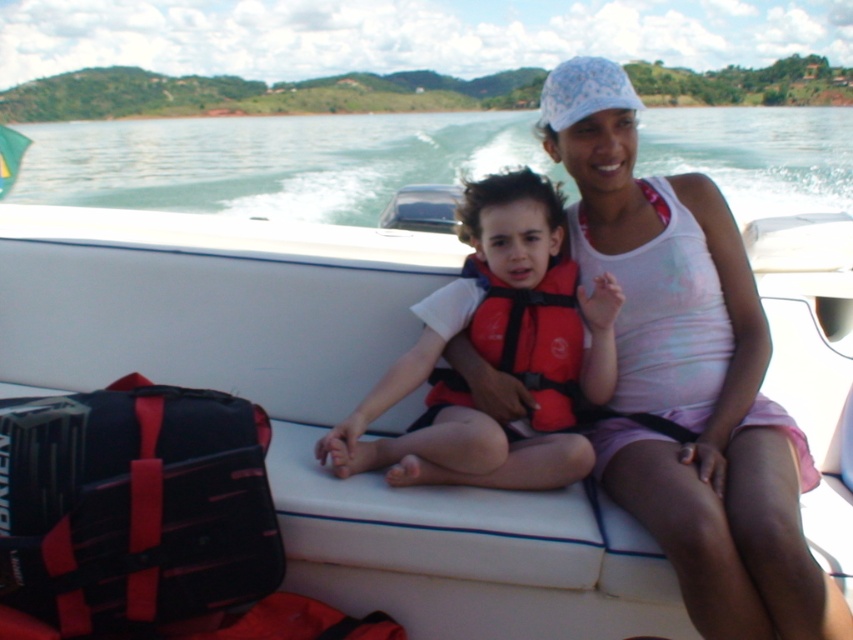
Question: Can you confirm if white tank top at center is smaller than red fabric life jacket at center?

Choices:
 (A) no
 (B) yes

Answer: (A)

Question: Which object is the farthest from the white tank top at center?

Choices:
 (A) matte orange life vest at center
 (B) green water at upper center

Answer: (B)

Question: Is green water at upper center to the right of red fabric life jacket at center from the viewer's perspective?

Choices:
 (A) no
 (B) yes

Answer: (B)

Question: Is white matte boat at center further to camera compared to matte orange life vest at center?

Choices:
 (A) yes
 (B) no

Answer: (B)

Question: Based on their relative distances, which object is farther from the white matte boat at center?

Choices:
 (A) red fabric life jacket at center
 (B) green water at upper center
 (C) white tank top at center
 (D) matte orange life vest at center

Answer: (B)

Question: Which point is farther from the camera taking this photo?

Choices:
 (A) (242, 296)
 (B) (363, 464)
 (C) (494, 355)
 (D) (616, 339)

Answer: (A)